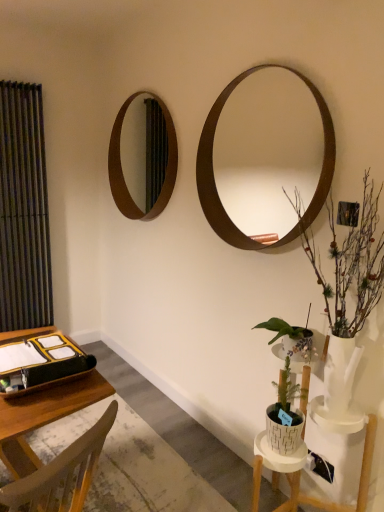
Question: Should I look upward or downward to see white textured pot at lower right, which is the 2th houseplant in top-to-bottom order?

Choices:
 (A) up
 (B) down

Answer: (B)

Question: Is brown wooden mirror at upper left, marked as the 1th mirror in a back-to-front arrangement, located within white textured pot at lower right, acting as the 1th houseplant starting from the bottom?

Choices:
 (A) no
 (B) yes

Answer: (A)

Question: Is white textured pot at lower right, acting as the 1th houseplant starting from the bottom, completely or partially outside of brown wooden mirror at upper left, arranged as the 2th mirror when viewed from the front?

Choices:
 (A) no
 (B) yes

Answer: (B)

Question: Considering the relative sizes of white textured pot at lower right, acting as the 1th houseplant starting from the bottom, and brown wooden mirror at upper left, the second mirror in the right-to-left sequence, in the image provided, is white textured pot at lower right, acting as the 1th houseplant starting from the bottom, thinner than brown wooden mirror at upper left, the second mirror in the right-to-left sequence,?

Choices:
 (A) no
 (B) yes

Answer: (A)

Question: Is white textured pot at lower right, acting as the 1th houseplant starting from the bottom, shorter than brown wooden mirror at upper left, the second mirror in the right-to-left sequence?

Choices:
 (A) no
 (B) yes

Answer: (B)

Question: Is white textured pot at lower right, which is the 2th houseplant in top-to-bottom order, smaller than brown wooden mirror at upper left, arranged as the 2th mirror when viewed from the front?

Choices:
 (A) yes
 (B) no

Answer: (A)

Question: Is white textured pot at lower right, acting as the 1th houseplant starting from the bottom, taller than brown wooden mirror at upper left, marked as the 1th mirror in a back-to-front arrangement?

Choices:
 (A) no
 (B) yes

Answer: (A)

Question: Can you confirm if brown wooden mirror at upper right, which appears as the second mirror when viewed from the back, is positioned to the right of wooden desk at lower left?

Choices:
 (A) yes
 (B) no

Answer: (A)

Question: Does brown wooden mirror at upper right, placed as the first mirror when sorted from right to left, have a larger size compared to wooden desk at lower left?

Choices:
 (A) no
 (B) yes

Answer: (A)

Question: From the image's perspective, does brown wooden mirror at upper right, placed as the first mirror when sorted from right to left, appear lower than wooden desk at lower left?

Choices:
 (A) no
 (B) yes

Answer: (A)

Question: Considering the relative positions of brown wooden mirror at upper right, acting as the 1th mirror starting from the front, and wooden desk at lower left in the image provided, is brown wooden mirror at upper right, acting as the 1th mirror starting from the front, in front of wooden desk at lower left?

Choices:
 (A) no
 (B) yes

Answer: (A)

Question: Is brown wooden mirror at upper right, the second mirror viewed from the left, with wooden desk at lower left?

Choices:
 (A) no
 (B) yes

Answer: (A)

Question: Would you say brown wooden mirror at upper right, which appears as the second mirror when viewed from the back, contains wooden desk at lower left?

Choices:
 (A) no
 (B) yes

Answer: (A)

Question: Would you say matte black curtain at left contains brown wooden mirror at upper right, placed as the first mirror when sorted from right to left?

Choices:
 (A) no
 (B) yes

Answer: (A)